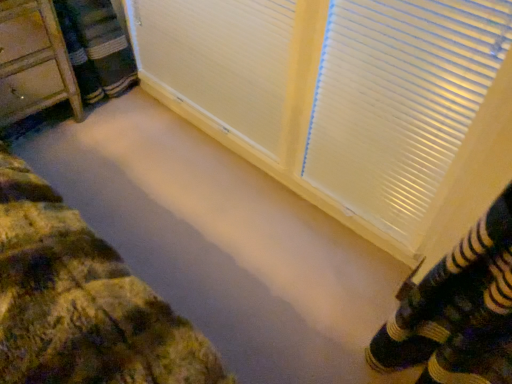
In the scene shown: Measure the distance between wooden dresser at left and camera.

wooden dresser at left and camera are 4.37 feet apart.

Describe the element at coordinates (33, 62) in the screenshot. I see `wooden dresser at left` at that location.

Where is `wooden dresser at left`? This screenshot has width=512, height=384. wooden dresser at left is located at coordinates (33, 62).

Locate an element on the screen. This screenshot has height=384, width=512. wooden dresser at left is located at coordinates (33, 62).